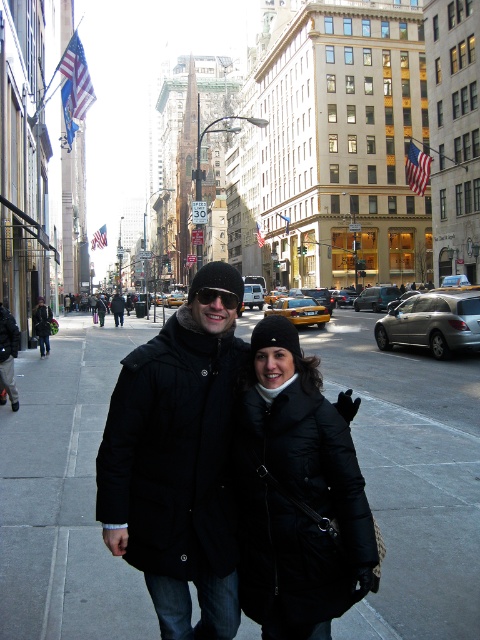
You are a photographer trying to capture a photo of the matte black coat at center. The camera you are using has a focus point set at coordinate point [300,312]. Will the focus point align with the matte black coat at center?

Yes, the focus point at coordinate point [300,312] will align with the matte black coat at center because the matte black coat at center is located at point [300,312].

You are a photographer trying to capture a photo of both the black puffy coat at center and the matte black coat at center. Based on their positions, which one is closer to the camera?

The black puffy coat at center is located below the matte black coat at center, meaning it is closer to the camera since it appears lower in the frame.